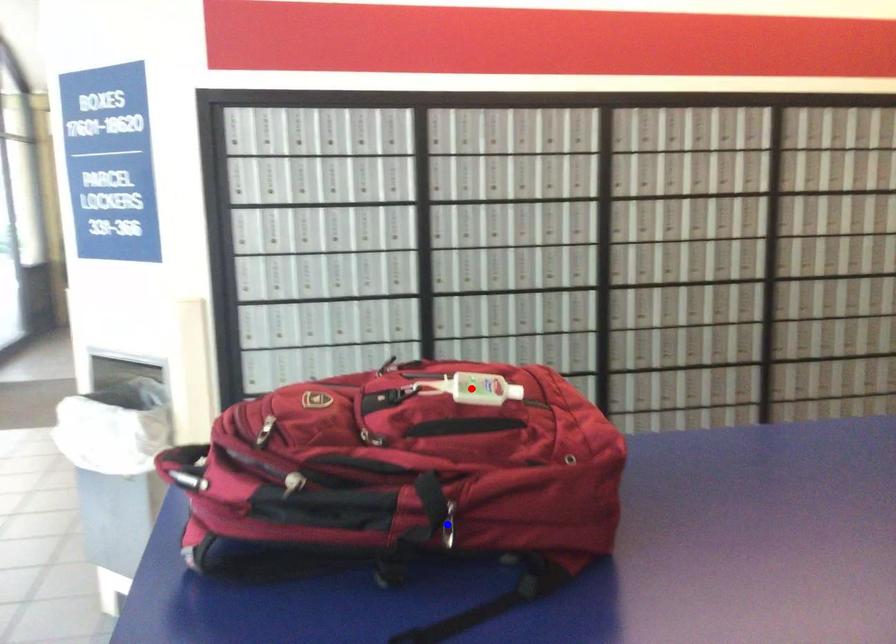
Question: In the image, two points are highlighted. Which point is nearer to the camera? Reply with the corresponding letter.

Choices:
 (A) blue point
 (B) red point

Answer: (A)